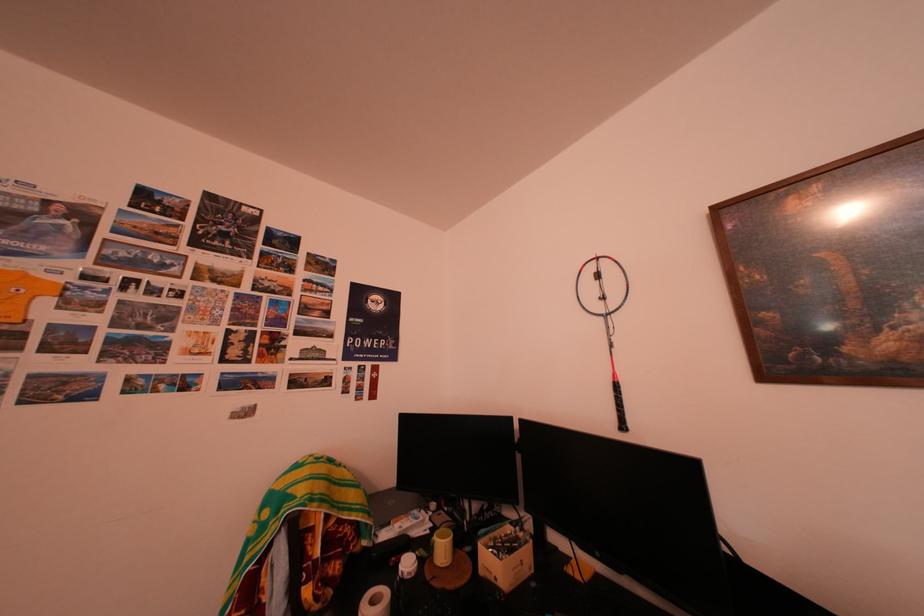
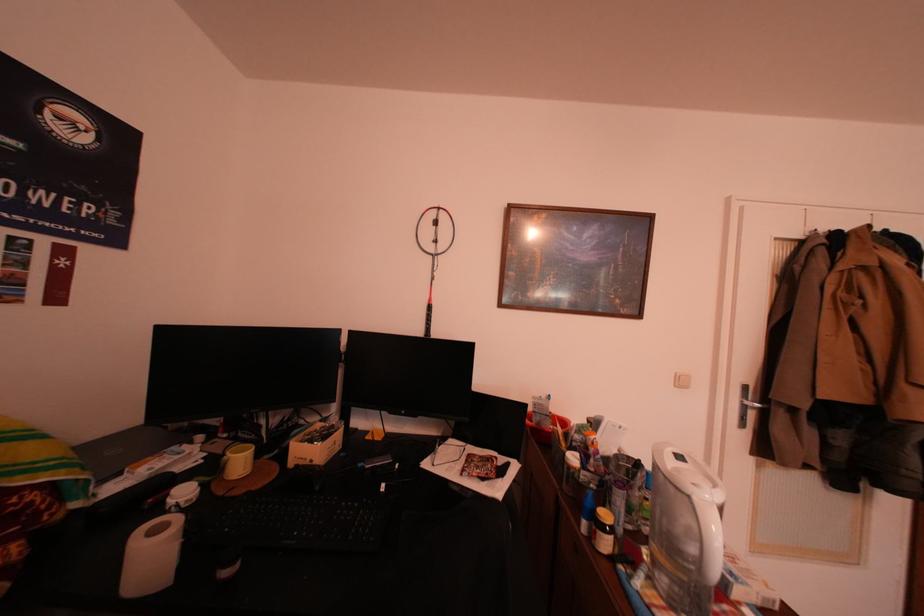
Question: The camera is either moving clockwise (left) or counter-clockwise (right) around the object. The first image is from the beginning of the video and the second image is from the end. Is the camera moving left or right when shooting the video?

Choices:
 (A) Left
 (B) Right

Answer: (A)